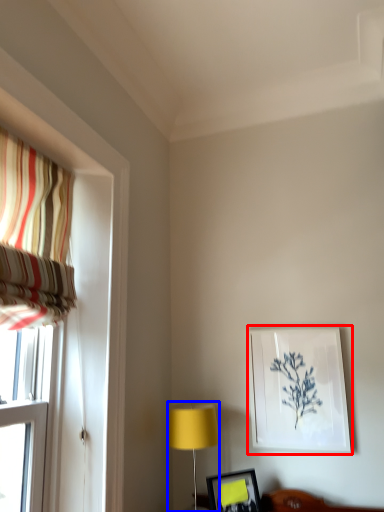
Question: Which point is closer to the camera, picture frame (highlighted by a red box) or table lamp (highlighted by a blue box)?

Choices:
 (A) picture frame
 (B) table lamp

Answer: (B)